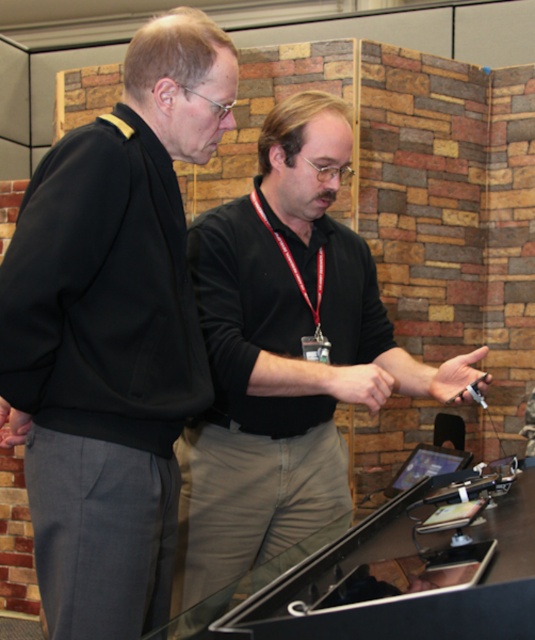
Based on the scene description, where exactly is the black matte jacket at left located in the image?

The black matte jacket at left is located at point coordinates of 0.520 on the x axis and 0.211 on the y axis.

You are organizing a photo shoot and need to ensure that the two participants are positioned so that the narrower garment does not overwhelm the wider one. Given the black matte jacket at left and the black matte shirt at center, which garment should be placed on the left side to maintain visual balance?

The black matte jacket at left is narrower than the black matte shirt at center. To maintain visual balance, the narrower black matte jacket at left should be placed on the left side so it doesn

You are at the coordinates of point [197,545] and want to walk towards the exit located at point [185,83]. Is the exit directly in front of you?

Yes, the exit at point [185,83] is directly in front of you since it is positioned in front of your current location at point [197,545].